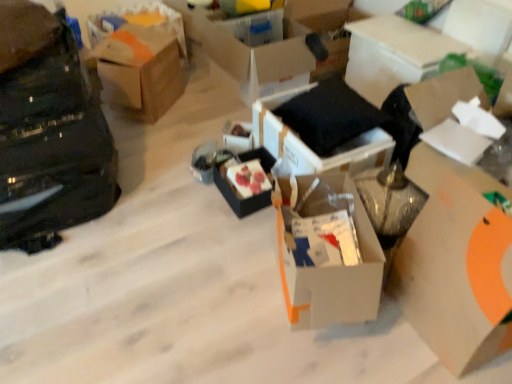
Question: Considering the relative sizes of black matte bag at left and white cardboard box at upper center, which ranks as the seventh box in left-to-right order, in the image provided, is black matte bag at left smaller than white cardboard box at upper center, which ranks as the seventh box in left-to-right order,?

Choices:
 (A) no
 (B) yes

Answer: (A)

Question: Is black matte bag at left positioned behind white cardboard box at upper center, the second box viewed from the right?

Choices:
 (A) yes
 (B) no

Answer: (B)

Question: From the image's perspective, is black matte bag at left over white cardboard box at upper center, which ranks as the seventh box in left-to-right order?

Choices:
 (A) no
 (B) yes

Answer: (A)

Question: Is white cardboard box at upper center, which ranks as the seventh box in left-to-right order, a part of black matte bag at left?

Choices:
 (A) no
 (B) yes

Answer: (A)

Question: Does black matte bag at left appear on the right side of white cardboard box at upper center, the second box viewed from the right?

Choices:
 (A) no
 (B) yes

Answer: (A)

Question: Can you confirm if black matte bag at left is thinner than white cardboard box at upper center, which ranks as the seventh box in left-to-right order?

Choices:
 (A) yes
 (B) no

Answer: (B)

Question: From a real-world perspective, is white cardboard box at right, acting as the sixth box starting from the left, beneath cardboard box at upper left, the third storage box when ordered from front to back?

Choices:
 (A) no
 (B) yes

Answer: (A)

Question: Is the position of white cardboard box at right, acting as the sixth box starting from the left, less distant than that of cardboard box at upper left, which is counted as the first storage box, starting from the back?

Choices:
 (A) no
 (B) yes

Answer: (B)

Question: Can cardboard box at upper left, the 1th storage box viewed from the left, be found inside white cardboard box at right, the third box in the right-to-left sequence?

Choices:
 (A) no
 (B) yes

Answer: (A)

Question: From the image's perspective, is white cardboard box at right, the third box in the right-to-left sequence, over cardboard box at upper left, the 1th storage box viewed from the left?

Choices:
 (A) no
 (B) yes

Answer: (A)

Question: Is white cardboard box at right, the third box in the right-to-left sequence, to the left of cardboard box at upper left, the 1th storage box viewed from the left, from the viewer's perspective?

Choices:
 (A) no
 (B) yes

Answer: (A)

Question: From the image's perspective, is white cardboard box at right, the third box in the right-to-left sequence, below cardboard box at upper left, the 3th storage box ordered from the bottom?

Choices:
 (A) no
 (B) yes

Answer: (B)

Question: Is black matte bag at left to the left of white cardboard box at center, which ranks as the fourth box in left-to-right order, from the viewer's perspective?

Choices:
 (A) no
 (B) yes

Answer: (B)